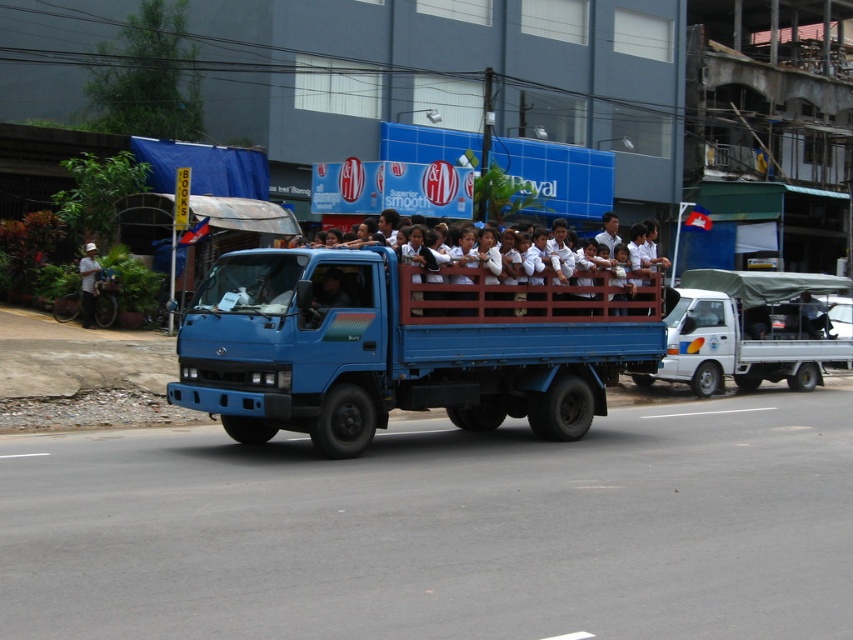
You are standing at the origin point of the image coordinate system. You want to walk to the blue metallic truck at center. In which direction should you move relative to the image coordinate system?

The blue metallic truck at center is located at point 0.539 in the x direction and 0.477 in the y direction relative to the image coordinate system. Since the origin is at the bottom left corner, you should move towards the right and upwards to reach it.

Based on the photo, you are a pedestrian standing at the side of the road. You see a blue metallic truck at center and a white matte truck at center. Which truck is closer to you?

The blue metallic truck at center is closer to you because it is in front of the white matte truck at center.